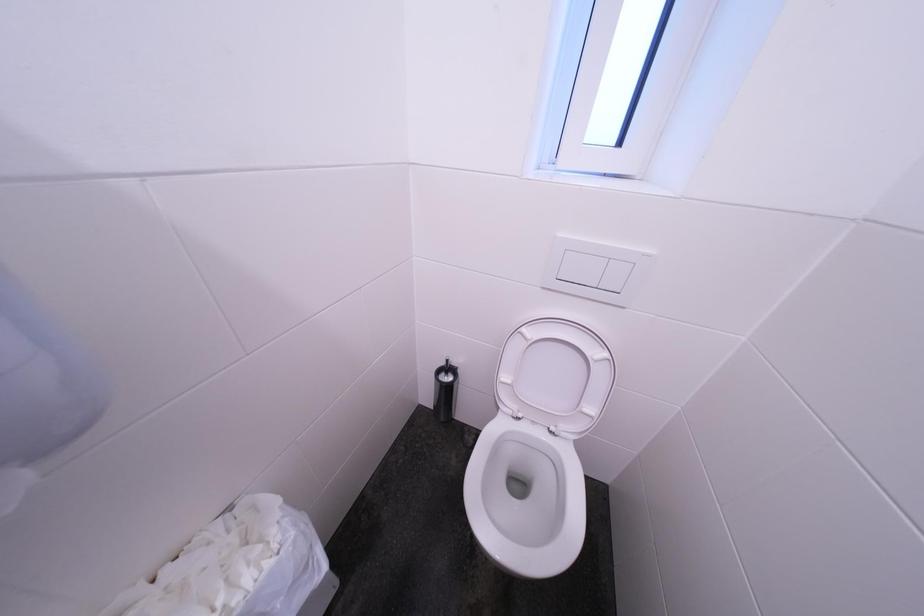
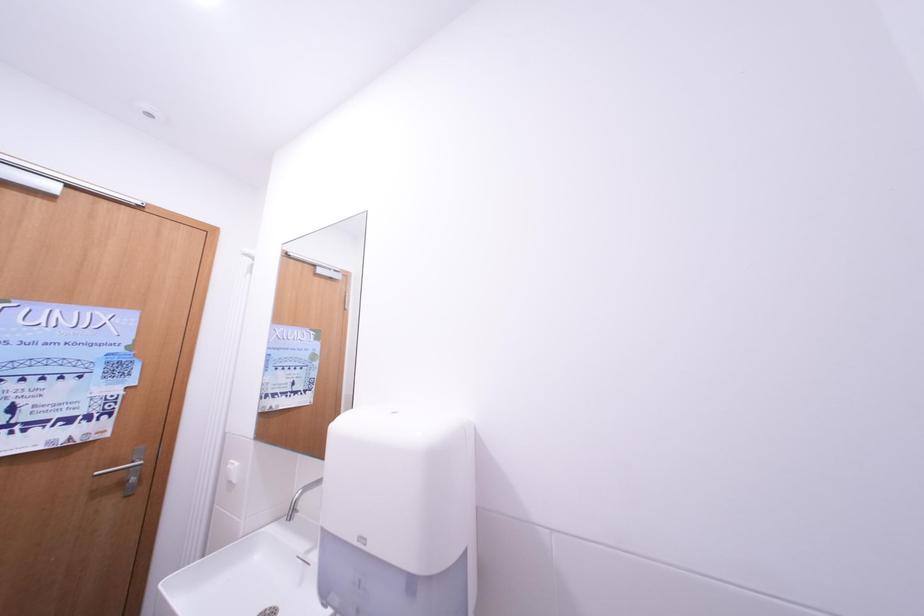
Question: How did the camera likely rotate?

Choices:
 (A) Left
 (B) Right
 (C) Up
 (D) Down

Answer: (A)